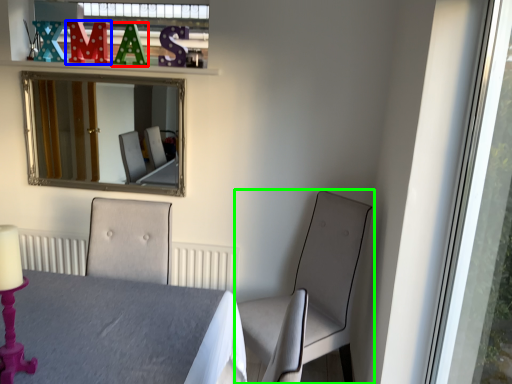
Question: Which is farther away from alphabet (highlighted by a red box)? alphabet (highlighted by a blue box) or chair (highlighted by a green box)?

Choices:
 (A) alphabet
 (B) chair

Answer: (B)